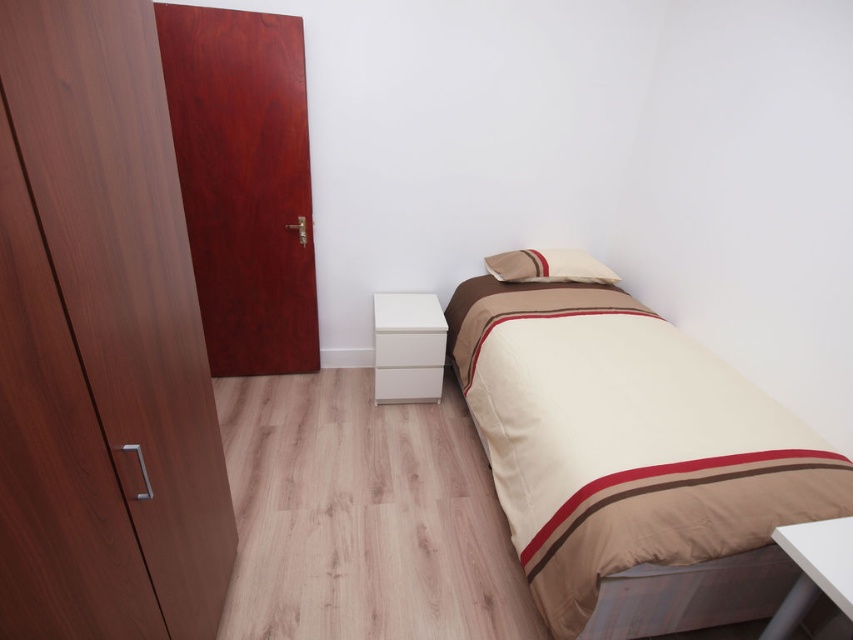
Question: Does beige fabric bed at right appear under beige soft pillow at upper center?

Choices:
 (A) yes
 (B) no

Answer: (A)

Question: Which object is the closest to the beige soft pillow at upper center?

Choices:
 (A) white matte drawer at lower center
 (B) white matte drawer at center

Answer: (A)

Question: Observing the image, what is the correct spatial positioning of beige soft pillow at upper center in reference to white matte drawer at center?

Choices:
 (A) right
 (B) left

Answer: (A)

Question: Is matte wood dresser at left thinner than beige soft pillow at upper center?

Choices:
 (A) no
 (B) yes

Answer: (B)

Question: Which point is closer to the camera?

Choices:
 (A) (64, 118)
 (B) (544, 376)
 (C) (390, 355)

Answer: (A)

Question: Which object appears farthest from the camera in this image?

Choices:
 (A) matte wood dresser at left
 (B) white matte drawer at lower center

Answer: (B)